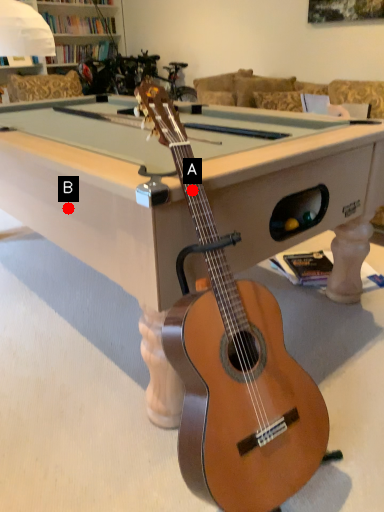
Question: Two points are circled on the image, labeled by A and B beside each circle. Which of the following is the farthest from the observer?

Choices:
 (A) A is further
 (B) B is further

Answer: (B)